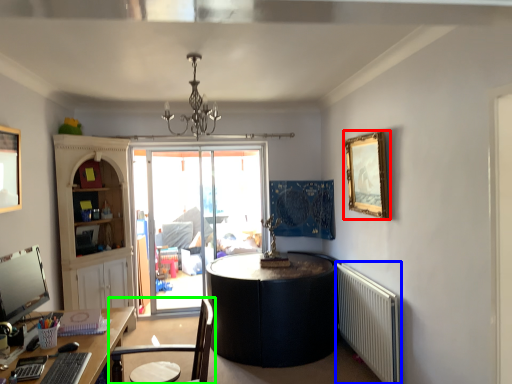
Question: Which is farther away from picture frame (highlighted by a red box)? radiator (highlighted by a blue box) or chair (highlighted by a green box)?

Choices:
 (A) radiator
 (B) chair

Answer: (B)